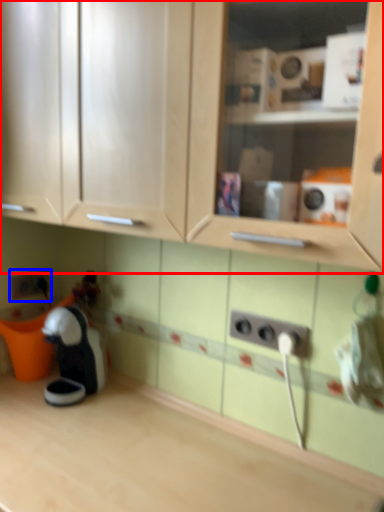
Question: Which of the following is the farthest to the observer, cabinetry (highlighted by a red box) or electric outlet (highlighted by a blue box)?

Choices:
 (A) cabinetry
 (B) electric outlet

Answer: (B)